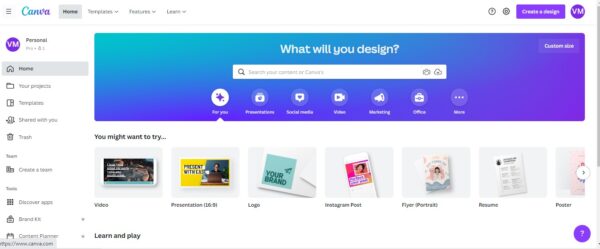
Where is `trash`? trash is located at coordinates (21, 137).